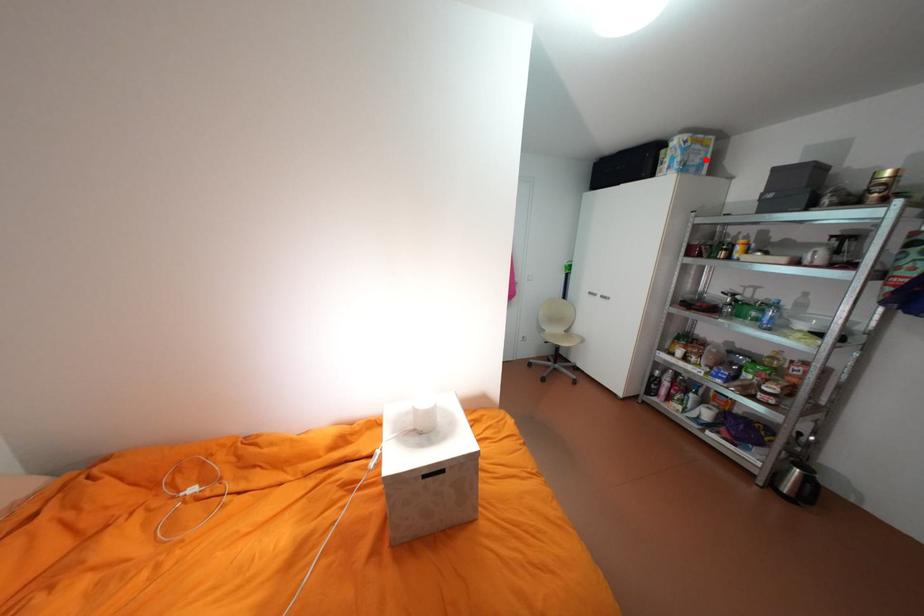
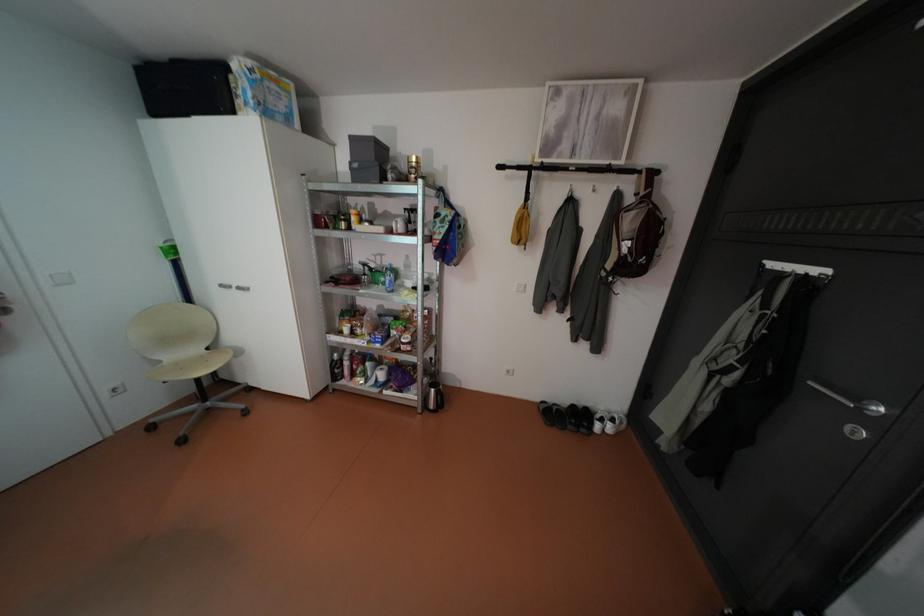
Find the pixel in the second image that matches the highlighted location in the first image.

(290, 107)